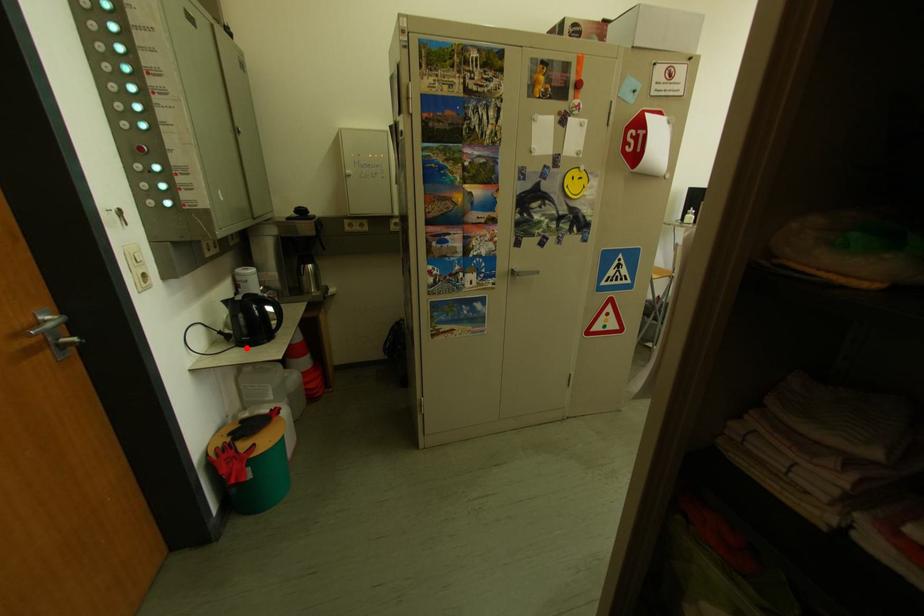
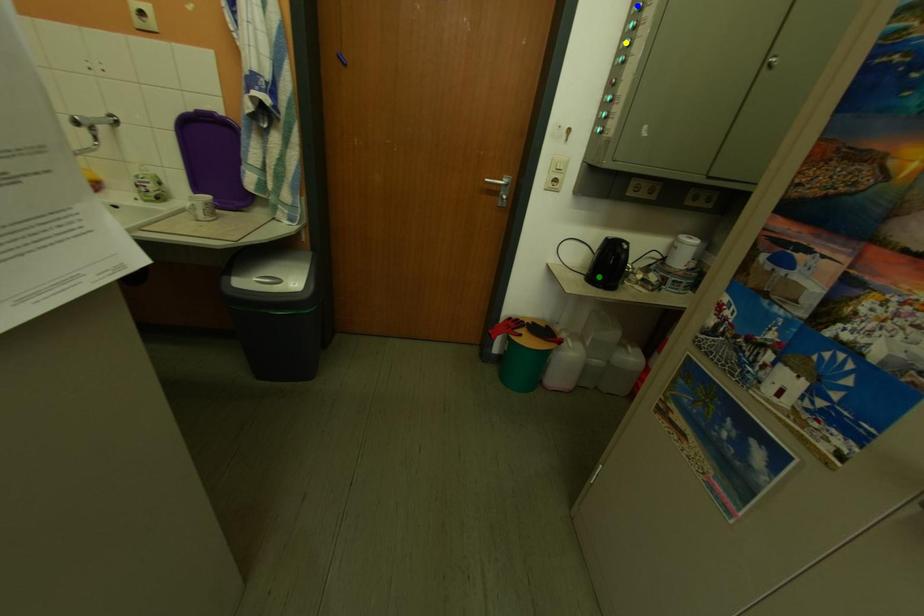
Question: I am providing you with two images of the same scene from different viewpoints. A red point is marked on the first image. You are given multiple points on the second image. Which point in image 2 is actually the same real-world point as the red point in image 1?

Choices:
 (A) blue point
 (B) yellow point
 (C) green point

Answer: (C)